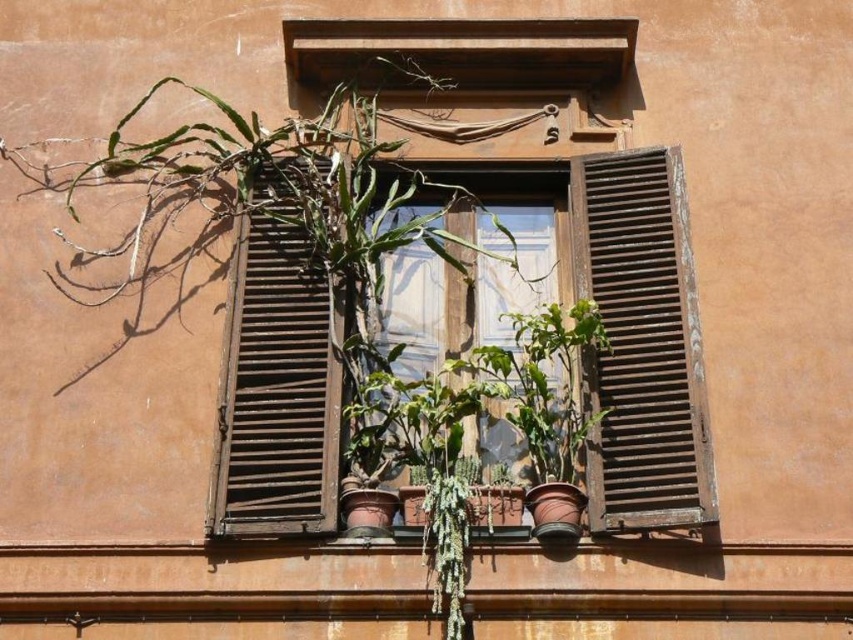
You are a gardener who wants to ensure proper sunlight for all plants. Given the green matte plant at left and the wooden at center are on the windowsill, which plant needs to be moved closer to the window to receive more light?

The wooden at center needs to be moved closer to the window because the green matte plant at left is much taller and may be blocking its sunlight.

You are standing in front of the building and notice the wooden at right. Can you determine its exact position relative to the window?

The wooden at right is located at point 0.537 on the x axis and 0.753 on the y axis.